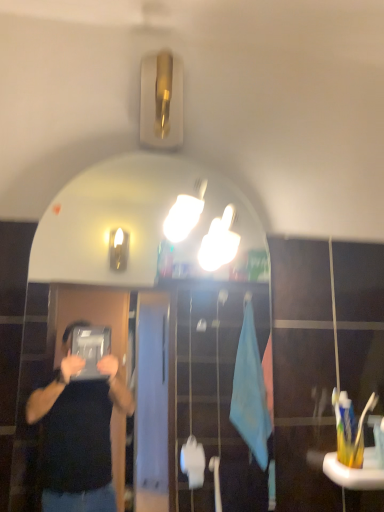
Question: Considering the relative positions of yellow plastic toothbrush at lower right, the third toothbrush from the left, and white glossy mirror at upper center in the image provided, is yellow plastic toothbrush at lower right, the third toothbrush from the left, to the left of white glossy mirror at upper center from the viewer's perspective?

Choices:
 (A) no
 (B) yes

Answer: (A)

Question: Is yellow plastic toothbrush at lower right, the first toothbrush viewed from the right, wider than white glossy mirror at upper center?

Choices:
 (A) no
 (B) yes

Answer: (B)

Question: Is yellow plastic toothbrush at lower right, the third toothbrush from the left, behind white glossy mirror at upper center?

Choices:
 (A) no
 (B) yes

Answer: (B)

Question: Considering the relative positions of yellow plastic toothbrush at lower right, the third toothbrush from the left, and white glossy mirror at upper center in the image provided, is yellow plastic toothbrush at lower right, the third toothbrush from the left, to the right of white glossy mirror at upper center from the viewer's perspective?

Choices:
 (A) yes
 (B) no

Answer: (A)

Question: Can you confirm if yellow plastic toothbrush at lower right, the third toothbrush from the left, is bigger than white glossy mirror at upper center?

Choices:
 (A) yes
 (B) no

Answer: (B)

Question: From a real-world perspective, is yellow plastic toothbrush at lower right, positioned as the 2th toothbrush in left-to-right order, above or below white glossy mirror at upper center?

Choices:
 (A) above
 (B) below

Answer: (B)

Question: Is yellow plastic toothbrush at lower right, the second toothbrush from the right, taller or shorter than white glossy mirror at upper center?

Choices:
 (A) short
 (B) tall

Answer: (A)

Question: Considering the positions of point (347, 394) and point (36, 244), is point (347, 394) closer or farther from the camera than point (36, 244)?

Choices:
 (A) closer
 (B) farther

Answer: (A)

Question: From the image's perspective, is yellow plastic toothbrush at lower right, positioned as the 2th toothbrush in left-to-right order, above or below white glossy mirror at upper center?

Choices:
 (A) above
 (B) below

Answer: (B)

Question: Is white glossy mirror at upper center spatially inside yellow plastic toothbrush at lower right, the second toothbrush from the right, or outside of it?

Choices:
 (A) inside
 (B) outside

Answer: (B)

Question: Would you say white glossy mirror at upper center is to the left or to the right of yellow plastic toothbrush at lower right, the second toothbrush from the right, in the picture?

Choices:
 (A) right
 (B) left

Answer: (B)

Question: From a real-world perspective, is white glossy mirror at upper center positioned above or below yellow plastic toothbrush at lower right, the second toothbrush from the right?

Choices:
 (A) below
 (B) above

Answer: (B)

Question: Considering the positions of point (89, 229) and point (345, 462), is point (89, 229) closer or farther from the camera than point (345, 462)?

Choices:
 (A) farther
 (B) closer

Answer: (A)

Question: From a real-world perspective, is white plastic toothbrush at right, which is counted as the 1th toothbrush, starting from the left, physically located above or below yellow plastic toothbrush at lower right, positioned as the 2th toothbrush in left-to-right order?

Choices:
 (A) above
 (B) below

Answer: (A)

Question: Is white plastic toothbrush at right, the 3th toothbrush from the right, spatially inside yellow plastic toothbrush at lower right, the second toothbrush from the right, or outside of it?

Choices:
 (A) outside
 (B) inside

Answer: (B)